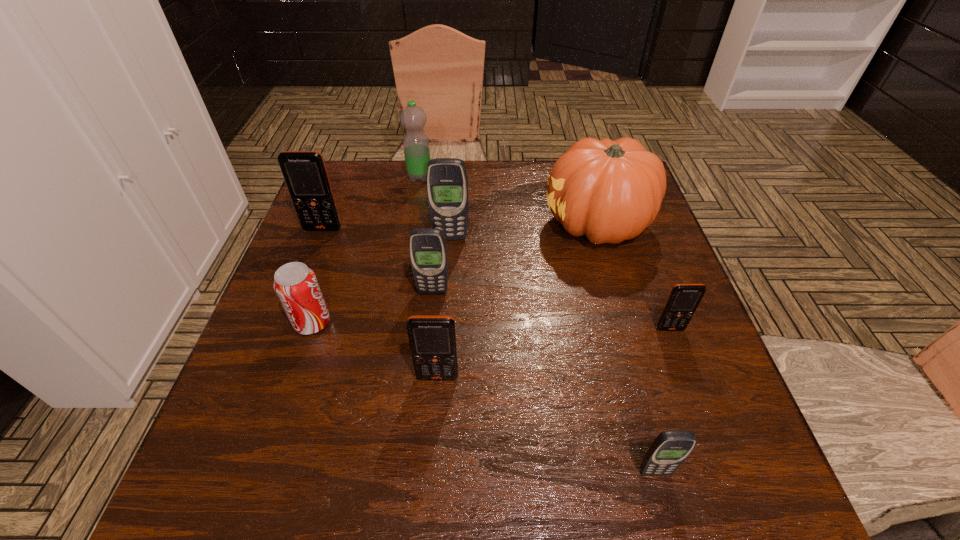
Find the location of a particular element. This screenshot has width=960, height=540. the third closest cellular telephone to the smallest orange cellular telephone is located at coordinates (428, 253).

This screenshot has width=960, height=540. Identify the location of cellular telephone that is the fifth closest to the pumpkin. (668, 451).

Choose which orange cellular telephone is the second nearest neighbor to the farthest orange cellular telephone. Please provide its 2D coordinates. Your answer should be formatted as a tuple, i.e. [(x, y)], where the tuple contains the x and y coordinates of a point satisfying the conditions above.

[(684, 299)]

Locate which orange cellular telephone is the second closest to the farthest cellular telephone. Please provide its 2D coordinates. Your answer should be formatted as a tuple, i.e. [(x, y)], where the tuple contains the x and y coordinates of a point satisfying the conditions above.

[(684, 299)]

You are a GUI agent. You are given a task and a screenshot of the screen. Output one action in this format:
    pyautogui.click(x=<x>, y=<y>)
    Task: Click on the closest gray cellular telephone to the pumpkin
    The width and height of the screenshot is (960, 540).
    Given the screenshot: What is the action you would take?
    pyautogui.click(x=446, y=180)

Locate an element on the screen. The height and width of the screenshot is (540, 960). gray cellular telephone that is the closest to the soda can is located at coordinates 428,253.

Identify the location of free space that satisfies the following two spatial constraints: 1. on the carved face of the pumpkin; 2. on the screen of the smallest gray cellular telephone. (669, 471).

At what (x,y) coordinates should I click in order to perform the action: click on vacant area in the image that satisfies the following two spatial constraints: 1. on the carved face of the pumpkin; 2. on the screen of the biggest orange cellular telephone. Please return your answer as a coordinate pair (x, y). Looking at the image, I should click on 599,229.